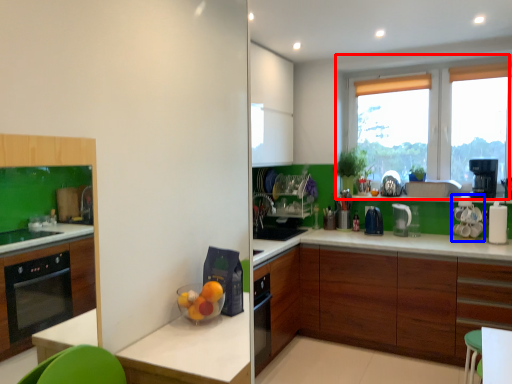
Question: Which of the following is the closest to the observer, window (highlighted by a red box) or appliance (highlighted by a blue box)?

Choices:
 (A) window
 (B) appliance

Answer: (B)